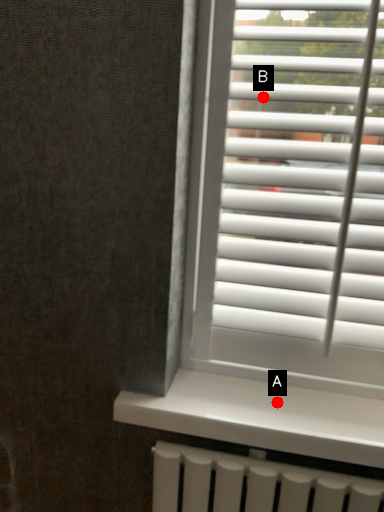
Question: Two points are circled on the image, labeled by A and B beside each circle. Among these points, which one is nearest to the camera?

Choices:
 (A) A is closer
 (B) B is closer

Answer: (B)